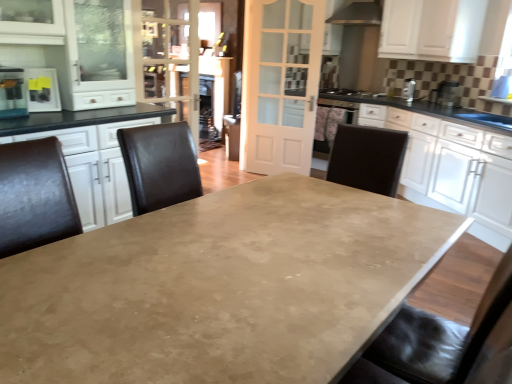
Where is `empty space that is ontop of matte concrete table at center (from a real-world perspective)`? empty space that is ontop of matte concrete table at center (from a real-world perspective) is located at coordinates (x=227, y=252).